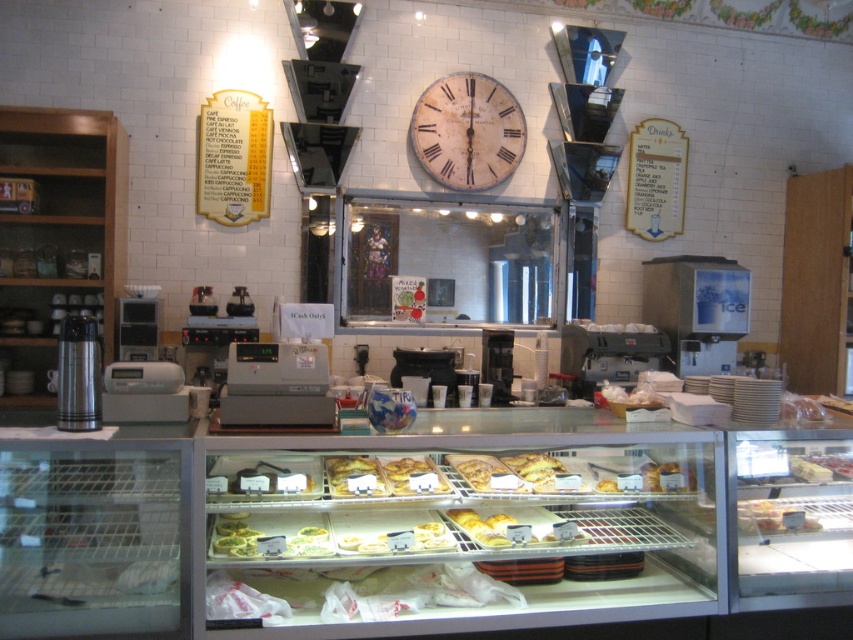
Between point (515, 152) and point (440, 474), which one is positioned behind?

Point (515, 152)

Where is `white wooden clock at center`? The height and width of the screenshot is (640, 853). white wooden clock at center is located at coordinates (467, 131).

Is the position of golden brown flaky pastry at center more distant than that of golden brown pastry at center?

That is False.

Who is more distant from viewer, (x=346, y=493) or (x=399, y=492)?

The point (x=399, y=492) is behind.

I want to click on golden brown flaky pastry at center, so click(352, 476).

Does white wooden clock at center have a greater height compared to golden brown flaky pastry at center?

Yes, white wooden clock at center is taller than golden brown flaky pastry at center.

The width and height of the screenshot is (853, 640). Describe the element at coordinates (467, 131) in the screenshot. I see `white wooden clock at center` at that location.

What do you see at coordinates (467, 131) in the screenshot?
I see `white wooden clock at center` at bounding box center [467, 131].

You are a GUI agent. You are given a task and a screenshot of the screen. Output one action in this format:
    pyautogui.click(x=<x>, y=<y>)
    Task: Click on the white wooden clock at center
    
    Given the screenshot: What is the action you would take?
    pyautogui.click(x=467, y=131)